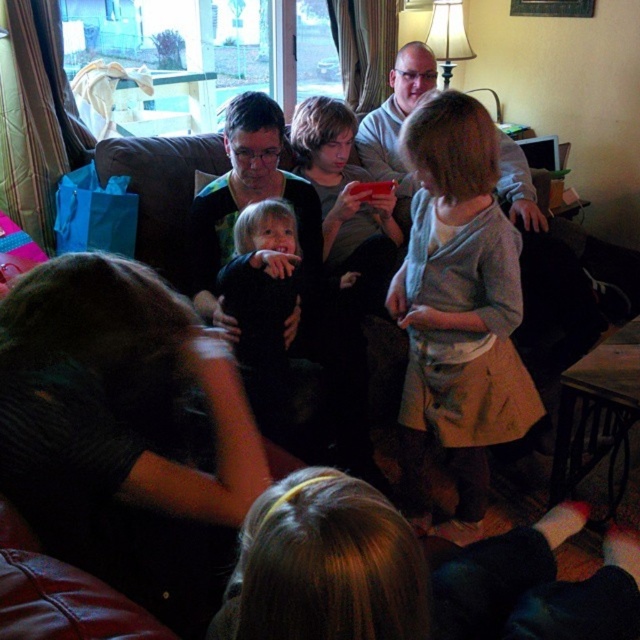
You are an interior designer planning to place a new decorative item at coordinate point 0.5, 0.7 in the living room. However, you notice the light gray knit sweater at center is already there. Can you place your item there without moving the sweater?

The light gray knit sweater at center is located at point (458, 305), which is very close to the desired coordinate (448, 320). However, since the sweater is already occupying that spot, placing the new item there would require moving the sweater.

You are a photographer trying to capture a candid shot of the two people at the center of the scene. The camera you are using has a maximum focus range of 20 inches. Can you focus on both the light gray knit sweater at center and the matte black shirt at center simultaneously?

The light gray knit sweater at center is 22.47 inches away from the matte black shirt at center. Since the distance between them exceeds the camera maximum focus range of 20 inches, you cannot focus on both simultaneously.